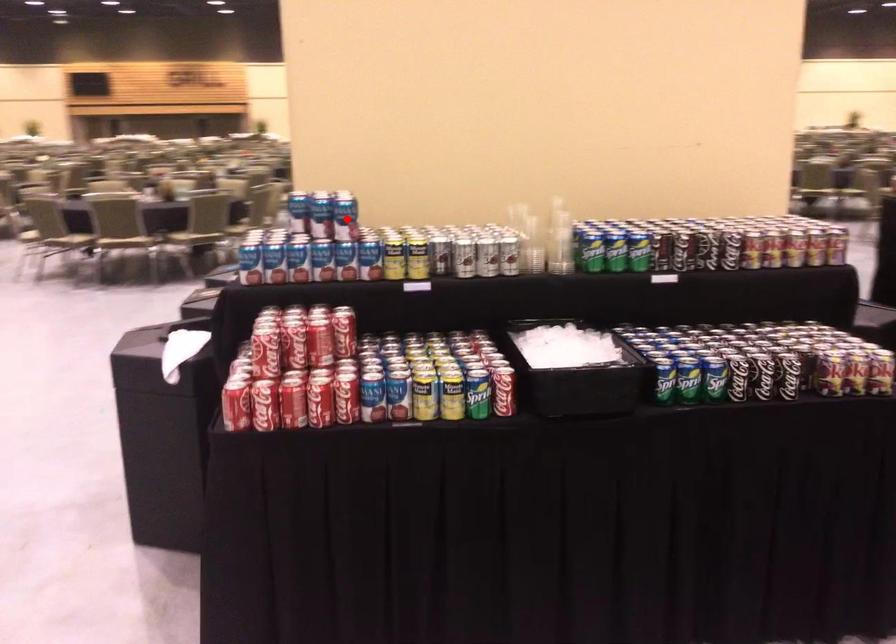
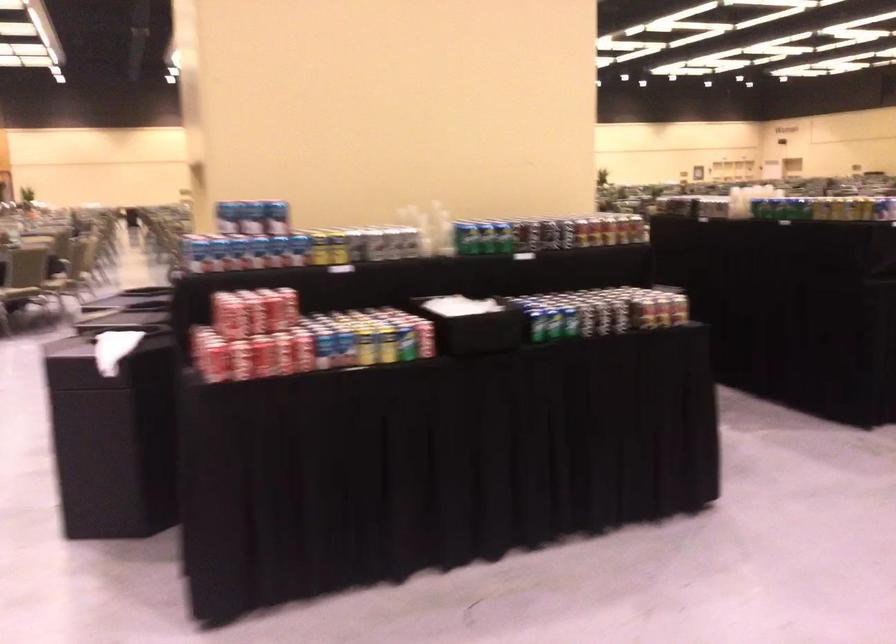
Question: I am providing you with two images of the same scene from different viewpoints. Image1 has a red point marked. In image2, the corresponding 3D location appears at what relative position? Reply with the corresponding letter.

Choices:
 (A) Closer
 (B) Farther

Answer: (B)